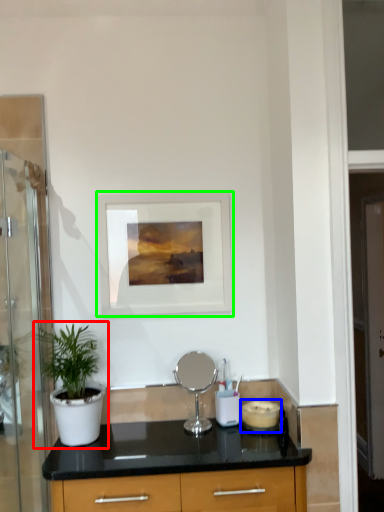
Question: Estimate the real-world distances between objects in this image. Which object is closer to houseplant (highlighted by a red box), appliance (highlighted by a blue box) or picture frame (highlighted by a green box)?

Choices:
 (A) appliance
 (B) picture frame

Answer: (B)